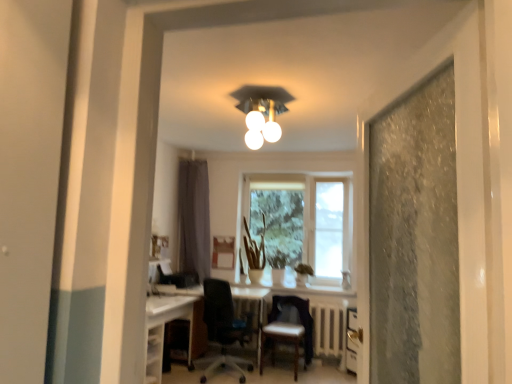
You are a GUI agent. You are given a task and a screenshot of the screen. Output one action in this format:
    pyautogui.click(x=<x>, y=<y>)
    Task: Click on the white glossy light fixture at upper center
    
    Given the screenshot: What is the action you would take?
    pyautogui.click(x=261, y=112)

This screenshot has width=512, height=384. Describe the element at coordinates (303, 220) in the screenshot. I see `transparent glass window at center` at that location.

This screenshot has height=384, width=512. Describe the element at coordinates (164, 329) in the screenshot. I see `white glossy computer desk at lower left` at that location.

The image size is (512, 384). I want to click on leather-like brown chair at center, which is the 2th chair in left-to-right order, so click(x=288, y=331).

Measure the distance between gray fabric curtain at center and camera.

gray fabric curtain at center and camera are 19.36 feet apart.

You are a GUI agent. You are given a task and a screenshot of the screen. Output one action in this format:
    pyautogui.click(x=<x>, y=<y>)
    Task: Click on the black mesh office chair at center, which ranks as the first chair in left-to-right order
    This screenshot has height=384, width=512.
    Given the screenshot: What is the action you would take?
    pyautogui.click(x=224, y=328)

The image size is (512, 384). In order to click on white glossy light fixture at upper center in this screenshot , I will do `click(261, 112)`.

The height and width of the screenshot is (384, 512). I want to click on light fixture above the leather-like brown chair at center, the first chair positioned from the right (from the image's perspective), so click(x=261, y=112).

Is white glossy light fixture at upper center closer to camera compared to leather-like brown chair at center, which is the 2th chair in left-to-right order?

Yes, it is in front of leather-like brown chair at center, which is the 2th chair in left-to-right order.

Between point (252, 108) and point (276, 333), which one is positioned in front?

The point (252, 108) is closer to the camera.

From the image's perspective, is white glossy light fixture at upper center above or below gray fabric curtain at center?

Based on their image positions, white glossy light fixture at upper center is located above gray fabric curtain at center.

Can you confirm if white glossy light fixture at upper center is taller than gray fabric curtain at center?

No.

How different are the orientations of white glossy light fixture at upper center and gray fabric curtain at center in degrees?

1.9 degrees.

Considering the positions of points (256, 85) and (191, 240), is point (256, 85) farther from camera compared to point (191, 240)?

No, (256, 85) is in front of (191, 240).

Is leather-like brown chair at center, which is the 2th chair in left-to-right order, not inside black mesh office chair at center, which ranks as the first chair in left-to-right order?

Yes, leather-like brown chair at center, which is the 2th chair in left-to-right order, is not within black mesh office chair at center, which ranks as the first chair in left-to-right order.

From the picture: In terms of size, does leather-like brown chair at center, the first chair positioned from the right, appear bigger or smaller than black mesh office chair at center, the 2th chair viewed from the right?

leather-like brown chair at center, the first chair positioned from the right, is smaller than black mesh office chair at center, the 2th chair viewed from the right.

Is leather-like brown chair at center, which is the 2th chair in left-to-right order, oriented away from black mesh office chair at center, which ranks as the first chair in left-to-right order?

leather-like brown chair at center, which is the 2th chair in left-to-right order, does not have its back to black mesh office chair at center, which ranks as the first chair in left-to-right order.

From a real-world perspective, is leather-like brown chair at center, the first chair positioned from the right, positioned under black mesh office chair at center, the 2th chair viewed from the right, based on gravity?

Yes, from a real-world perspective, leather-like brown chair at center, the first chair positioned from the right, is under black mesh office chair at center, the 2th chair viewed from the right.

Which is farther, [274,211] or [247,107]?

Positioned behind is point [274,211].

From the image's perspective, is transparent glass window at center above white glossy light fixture at upper center?

No, from the image's perspective, transparent glass window at center is not on top of white glossy light fixture at upper center.

Can we say transparent glass window at center lies outside white glossy light fixture at upper center?

Yes, transparent glass window at center is not within white glossy light fixture at upper center.

Considering the relative sizes of white glossy light fixture at upper center and white glossy computer desk at lower left in the image provided, is white glossy light fixture at upper center smaller than white glossy computer desk at lower left?

Yes.

Considering the sizes of objects white glossy light fixture at upper center and white glossy computer desk at lower left in the image provided, who is wider, white glossy light fixture at upper center or white glossy computer desk at lower left?

Wider between the two is white glossy computer desk at lower left.

The image size is (512, 384). What are the coordinates of `light fixture above the white glossy computer desk at lower left (from a real-world perspective)` in the screenshot? It's located at (261, 112).

Can you tell me how much white glossy light fixture at upper center and white glossy computer desk at lower left differ in facing direction?

88.7 degrees.

In the scene shown: From their relative heights in the image, would you say white glossy computer desk at lower left is taller or shorter than white glossy light fixture at upper center?

white glossy computer desk at lower left is taller than white glossy light fixture at upper center.

Locate an element on the screen. Image resolution: width=512 pixels, height=384 pixels. computer desk on the left of white glossy light fixture at upper center is located at coordinates (164, 329).

Which object is positioned more to the left, white glossy computer desk at lower left or white glossy light fixture at upper center?

white glossy computer desk at lower left is more to the left.

Is white glossy computer desk at lower left far away from white glossy light fixture at upper center?

Yes.

Which is behind, point (218, 325) or point (298, 174)?

Point (298, 174)

Is black mesh office chair at center, the 2th chair viewed from the right, completely or partially outside of transparent glass window at center?

Absolutely, black mesh office chair at center, the 2th chair viewed from the right, is external to transparent glass window at center.

Locate an element on the screen. The image size is (512, 384). window that is on the right side of black mesh office chair at center, which ranks as the first chair in left-to-right order is located at coordinates (303, 220).

Who is taller, black mesh office chair at center, which ranks as the first chair in left-to-right order, or transparent glass window at center?

transparent glass window at center is taller.

From the image's perspective, starting from the white glossy light fixture at upper center, which chair is the 2nd one below? Please provide its 2D coordinates.

[(288, 331)]

The height and width of the screenshot is (384, 512). I want to click on curtain on the left of white glossy light fixture at upper center, so [x=194, y=217].

Looking at the image, which one is located closer to black mesh office chair at center, which ranks as the first chair in left-to-right order, transparent glass window at center or white glossy light fixture at upper center?

Based on the image, transparent glass window at center appears to be nearer to black mesh office chair at center, which ranks as the first chair in left-to-right order.

Estimate the real-world distances between objects in this image. Which object is further from gray fabric curtain at center, white glossy light fixture at upper center or black mesh office chair at center, which ranks as the first chair in left-to-right order?

The object further to gray fabric curtain at center is white glossy light fixture at upper center.

Based on their spatial positions, is black mesh office chair at center, the 2th chair viewed from the right, or leather-like brown chair at center, which is the 2th chair in left-to-right order, further from gray fabric curtain at center?

leather-like brown chair at center, which is the 2th chair in left-to-right order, lies further to gray fabric curtain at center than the other object.

When comparing their distances from transparent glass window at center, does gray fabric curtain at center or black mesh office chair at center, the 2th chair viewed from the right, seem closer?

gray fabric curtain at center is positioned closer to the anchor transparent glass window at center.

From the image, which object appears to be farther from white glossy light fixture at upper center, transparent glass window at center or leather-like brown chair at center, the first chair positioned from the right?

leather-like brown chair at center, the first chair positioned from the right, is positioned further to the anchor white glossy light fixture at upper center.

When comparing their distances from transparent glass window at center, does leather-like brown chair at center, the first chair positioned from the right, or white glossy light fixture at upper center seem further?

white glossy light fixture at upper center.

Considering their positions, is white glossy computer desk at lower left positioned closer to white glossy light fixture at upper center than gray fabric curtain at center?

The object closer to white glossy light fixture at upper center is white glossy computer desk at lower left.

Estimate the real-world distances between objects in this image. Which object is further from white glossy light fixture at upper center, transparent glass window at center or black mesh office chair at center, which ranks as the first chair in left-to-right order?

Based on the image, black mesh office chair at center, which ranks as the first chair in left-to-right order, appears to be further to white glossy light fixture at upper center.

Where is `chair between white glossy light fixture at upper center and leather-like brown chair at center, the first chair positioned from the right, in the up-down direction`? chair between white glossy light fixture at upper center and leather-like brown chair at center, the first chair positioned from the right, in the up-down direction is located at coordinates (224, 328).

Find the location of a particular element. This screenshot has height=384, width=512. chair between white glossy computer desk at lower left and leather-like brown chair at center, the first chair positioned from the right, from left to right is located at coordinates (224, 328).

Where is `window between black mesh office chair at center, the 2th chair viewed from the right, and gray fabric curtain at center from front to back`? The width and height of the screenshot is (512, 384). window between black mesh office chair at center, the 2th chair viewed from the right, and gray fabric curtain at center from front to back is located at coordinates (303, 220).

Locate an element on the screen. This screenshot has width=512, height=384. curtain between white glossy light fixture at upper center and leather-like brown chair at center, which is the 2th chair in left-to-right order, vertically is located at coordinates (194, 217).